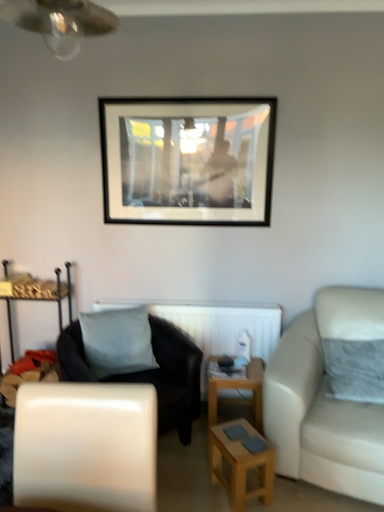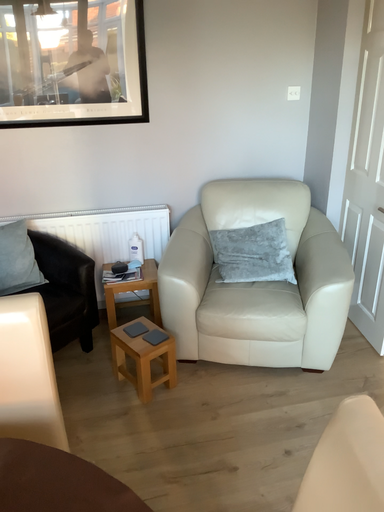
Question: How did the camera likely rotate when shooting the video?

Choices:
 (A) rotated upward
 (B) rotated downward

Answer: (B)